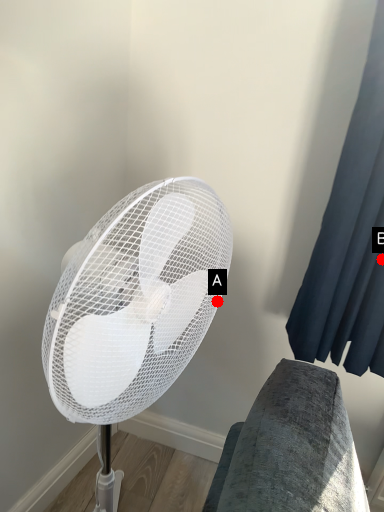
Question: Two points are circled on the image, labeled by A and B beside each circle. Which point is closer to the camera?

Choices:
 (A) A is closer
 (B) B is closer

Answer: (A)